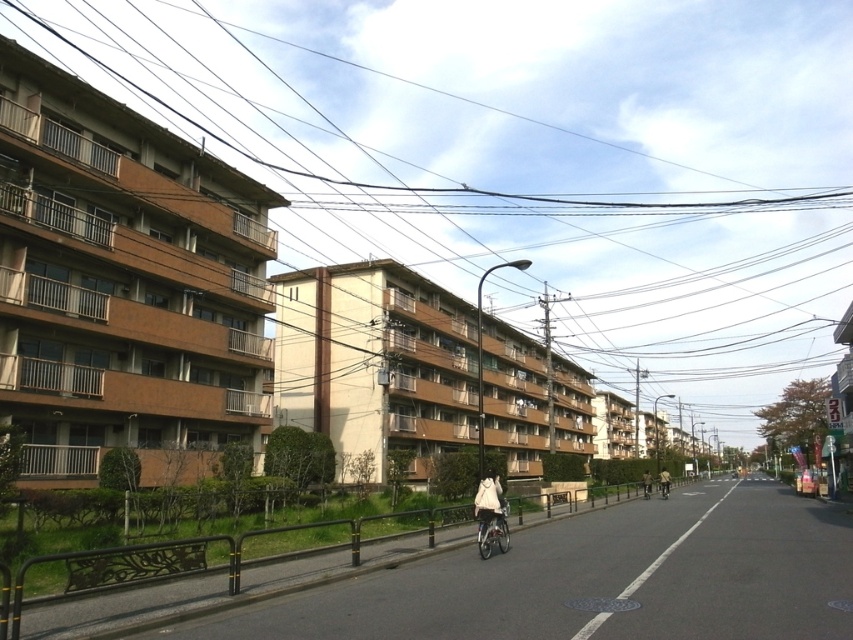
Question: Does brown wire at upper center have a lesser width compared to matte black bicycle at center-right?

Choices:
 (A) yes
 (B) no

Answer: (B)

Question: Among these points, which one is farthest from the camera?

Choices:
 (A) (483, 477)
 (B) (492, 540)

Answer: (A)

Question: Which object appears closest to the camera in this image?

Choices:
 (A) khaki fabric jacket at center
 (B) metallic silver bicycle at center

Answer: (B)

Question: Which point is closer to the camera taking this photo?

Choices:
 (A) (647, 483)
 (B) (479, 550)
 (C) (798, 188)

Answer: (B)

Question: Does brown wire at upper center appear over khaki fabric jacket at center?

Choices:
 (A) no
 (B) yes

Answer: (B)

Question: Can you confirm if metallic silver bicycle at center is positioned below khaki fabric jacket at center?

Choices:
 (A) no
 (B) yes

Answer: (A)